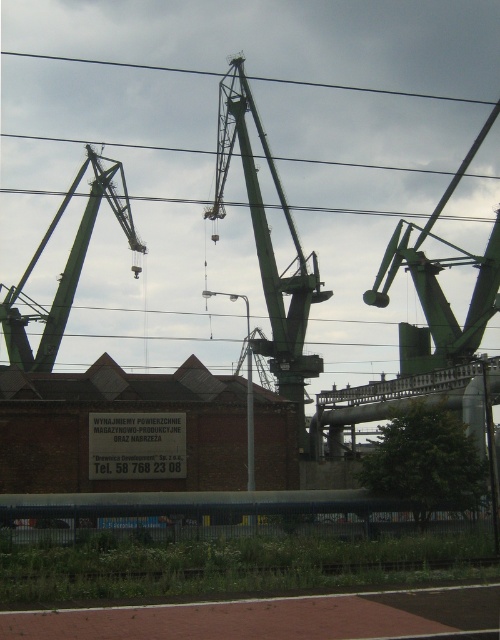
Question: Which of the following is the farthest from the observer?

Choices:
 (A) green matte crane at center
 (B) black wire at upper center
 (C) green metallic crane at left

Answer: (B)

Question: Based on their relative distances, which object is nearer to the black wire at upper center?

Choices:
 (A) green matte crane at center
 (B) green metallic crane at left

Answer: (B)

Question: Based on their relative distances, which object is farther from the black wire at upper center?

Choices:
 (A) green metallic crane at left
 (B) green matte crane at center

Answer: (B)

Question: Can you confirm if green matte crane at center is bigger than black wire at upper center?

Choices:
 (A) no
 (B) yes

Answer: (B)

Question: Does green matte crane at center appear under black wire at upper center?

Choices:
 (A) no
 (B) yes

Answer: (B)

Question: Is green matte crane at center further to the viewer compared to green metallic crane at left?

Choices:
 (A) no
 (B) yes

Answer: (A)